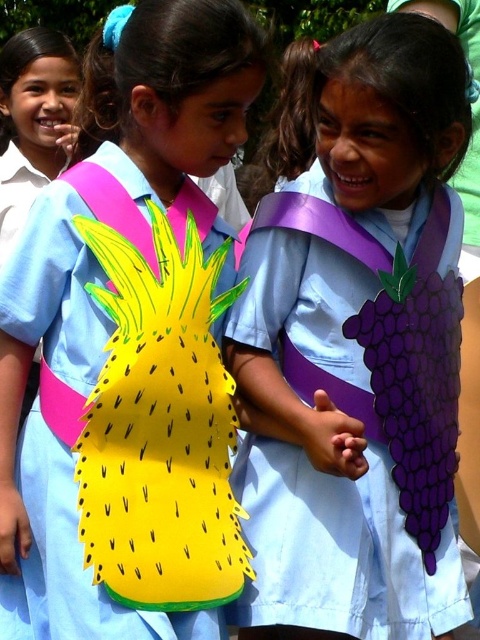
Is yellow paper pineapple at center taller than purple matte grapevine at center?

Correct, yellow paper pineapple at center is much taller as purple matte grapevine at center.

Is yellow paper pineapple at center to the left of purple matte grapevine at center from the viewer's perspective?

Result: Correct, you'll find yellow paper pineapple at center to the left of purple matte grapevine at center.

Image resolution: width=480 pixels, height=640 pixels. I want to click on yellow paper pineapple at center, so click(69, 563).